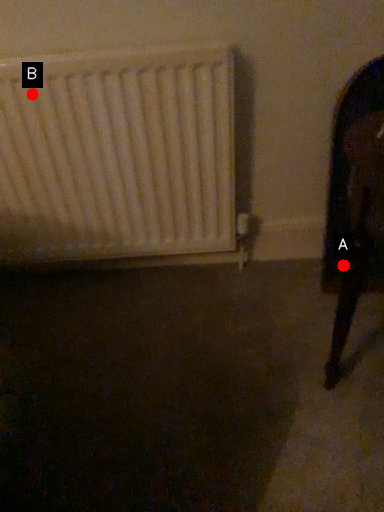
Question: Two points are circled on the image, labeled by A and B beside each circle. Among these points, which one is farthest from the camera?

Choices:
 (A) A is further
 (B) B is further

Answer: (A)